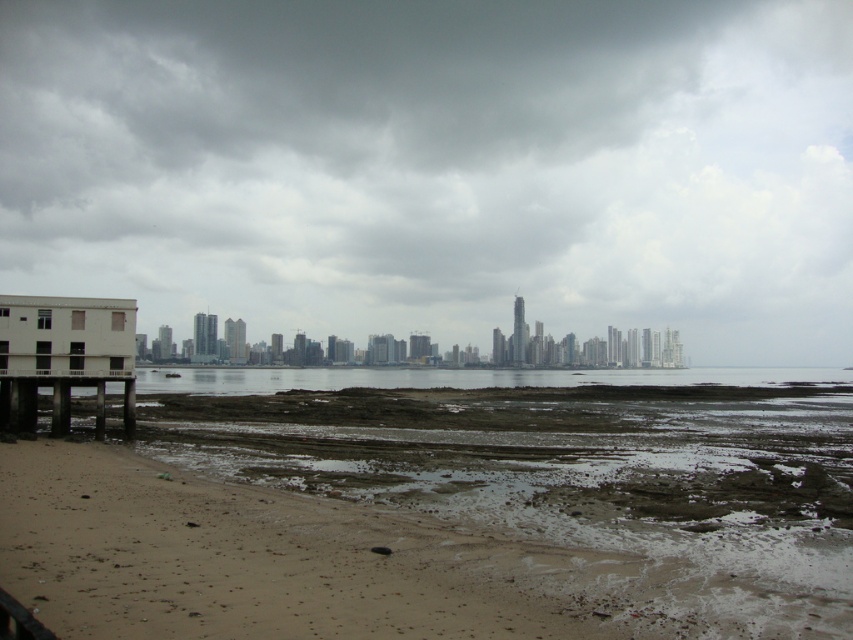
Which of these two, white concrete dock at lower left or clear water at center, stands taller?

Standing taller between the two is clear water at center.

Which is behind, point (64, 424) or point (811, 378)?

The point (811, 378) is behind.

This screenshot has height=640, width=853. I want to click on white concrete dock at lower left, so click(x=62, y=356).

Can you confirm if brown sandy beach at lower left is thinner than white concrete dock at lower left?

In fact, brown sandy beach at lower left might be wider than white concrete dock at lower left.

Does brown sandy beach at lower left have a smaller size compared to white concrete dock at lower left?

Incorrect, brown sandy beach at lower left is not smaller in size than white concrete dock at lower left.

Is point (285, 433) positioned before point (51, 314)?

No.

The image size is (853, 640). What are the coordinates of `brown sandy beach at lower left` in the screenshot? It's located at (445, 515).

Is gray cloudy sky at center shorter than brown sandy beach at lower left?

No, gray cloudy sky at center is not shorter than brown sandy beach at lower left.

Between point (289, 138) and point (312, 636), which one is positioned in front?

Point (312, 636) is more forward.

Locate an element on the screen. Image resolution: width=853 pixels, height=640 pixels. gray cloudy sky at center is located at coordinates (439, 168).